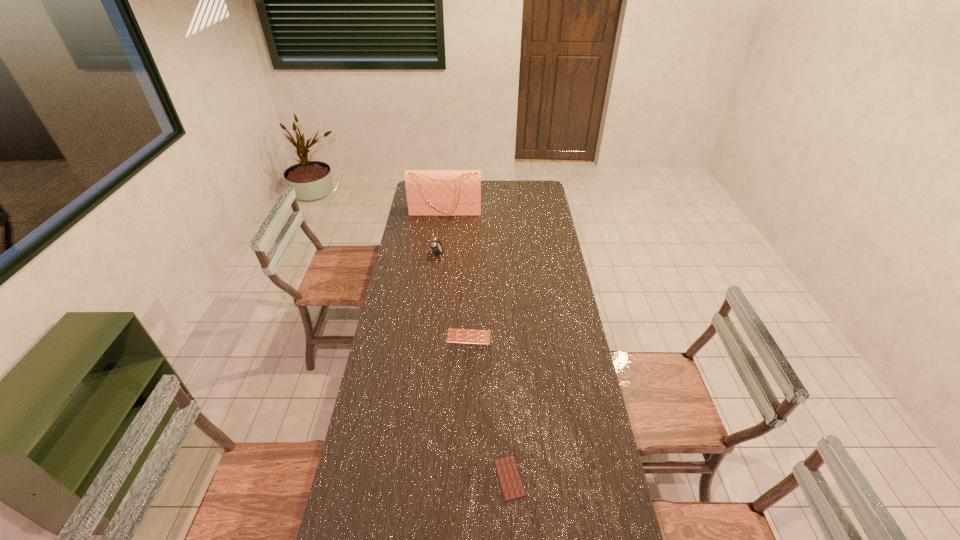
Identify the location of vacant space located 0.300m on the right of the farther chocolate bar. (567, 336).

Where is `vacant space located 0.050m on the back of the nearer chocolate bar`? Image resolution: width=960 pixels, height=540 pixels. vacant space located 0.050m on the back of the nearer chocolate bar is located at coordinates (508, 441).

Locate an element on the screen. The width and height of the screenshot is (960, 540). handbag positioned at the left edge is located at coordinates coord(429,192).

This screenshot has height=540, width=960. Find the location of `alarm clock located in the left edge section of the desktop`. alarm clock located in the left edge section of the desktop is located at coordinates (437, 248).

At what (x,y) coordinates should I click in order to perform the action: click on free space at the left edge of the desktop. Please return your answer as a coordinate pair (x, y). This screenshot has height=540, width=960. Looking at the image, I should click on click(416, 241).

At what (x,y) coordinates should I click in order to perform the action: click on free region at the right edge. Please return your answer as a coordinate pair (x, y). Looking at the image, I should click on (564, 264).

This screenshot has height=540, width=960. I want to click on vacant space at the far right corner, so click(x=534, y=194).

Find the location of a particular element. free space between the shorter chocolate bar and the farther chocolate bar is located at coordinates (489, 407).

The image size is (960, 540). I want to click on free space between the alarm clock and the taller chocolate bar, so click(x=453, y=295).

Identify the location of empty location between the second shortest object and the handbag. (457, 274).